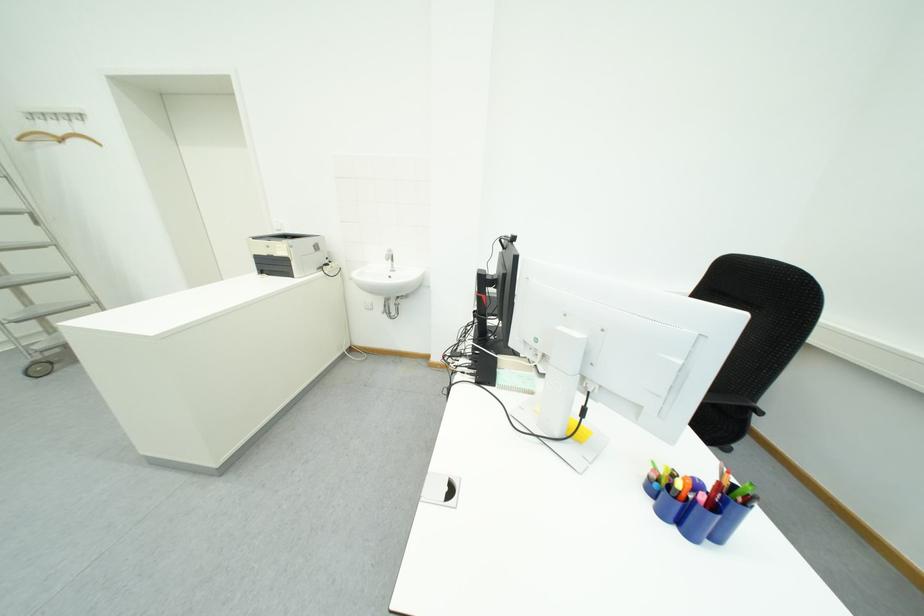
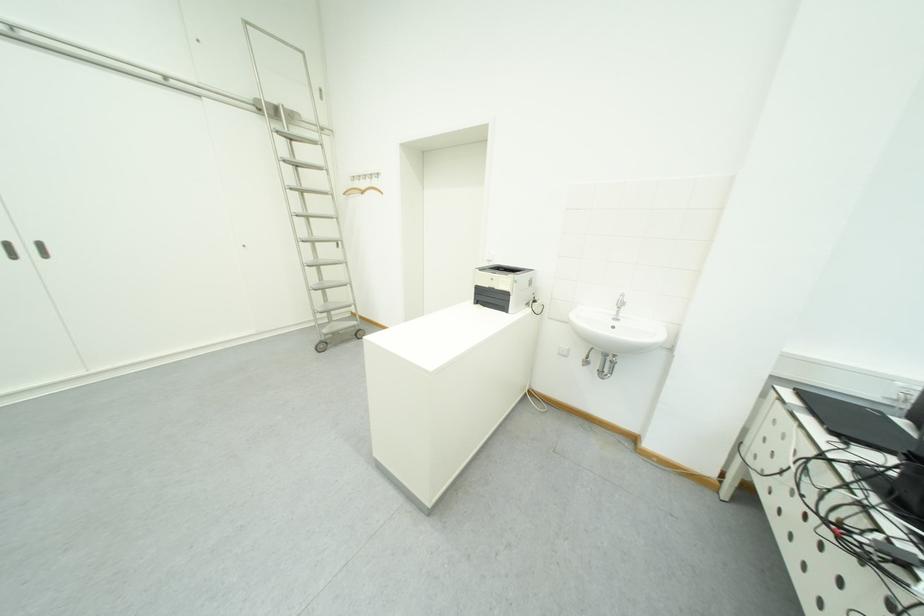
Question: The images are taken continuously from a first-person perspective. In which direction is your viewpoint rotating?

Choices:
 (A) Left
 (B) Right
 (C) Up
 (D) Down

Answer: (A)